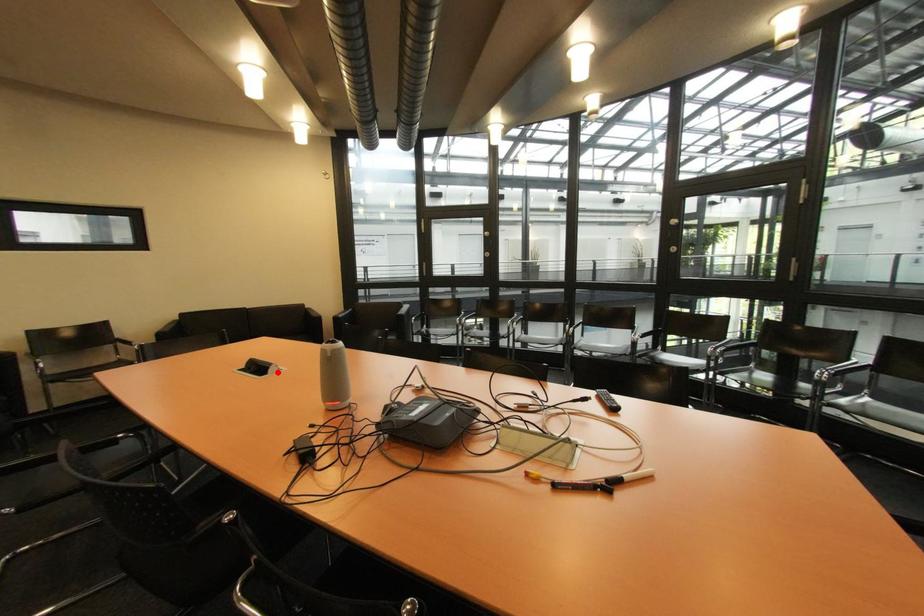
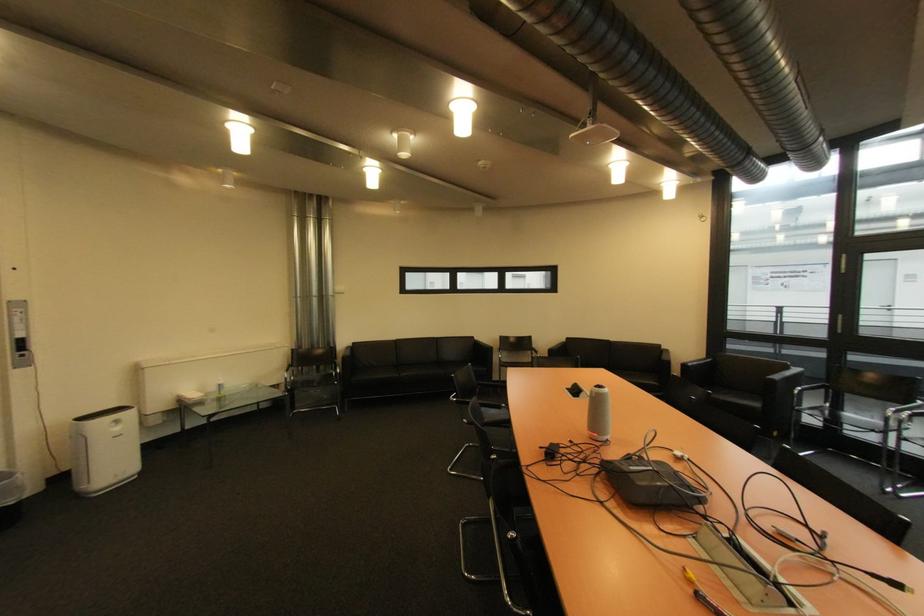
Question: I am providing you with two images of the same scene from different viewpoints. A red point is marked on the first image. Can you still see the location of the red point in image 2?

Choices:
 (A) Yes
 (B) No

Answer: (A)